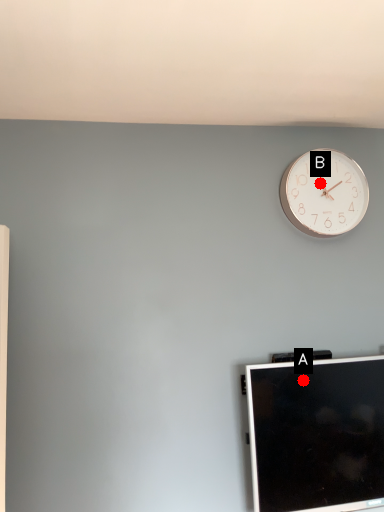
Question: Two points are circled on the image, labeled by A and B beside each circle. Which point appears farthest from the camera in this image?

Choices:
 (A) A is further
 (B) B is further

Answer: (B)